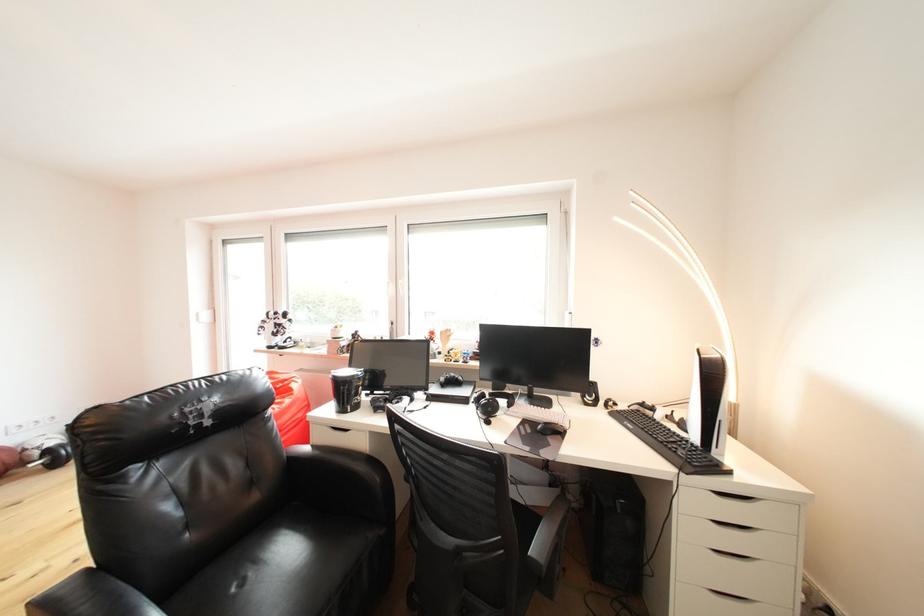
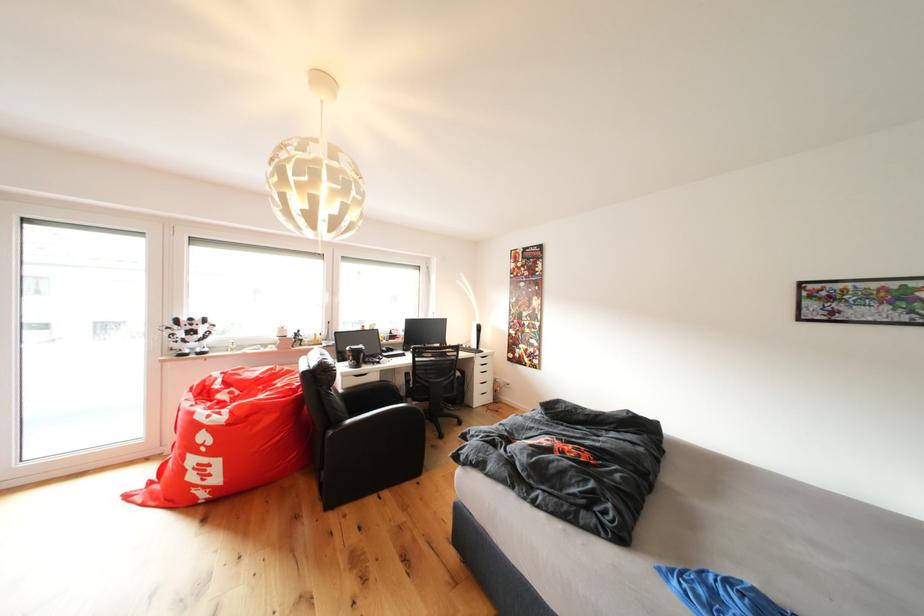
The point at (286,318) is marked in the first image. Where is the corresponding point in the second image?

(200, 323)